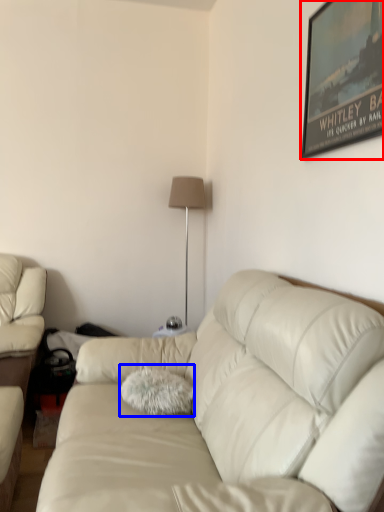
Question: Which point is further to the camera, picture frame (highlighted by a red box) or throw pillow (highlighted by a blue box)?

Choices:
 (A) picture frame
 (B) throw pillow

Answer: (B)